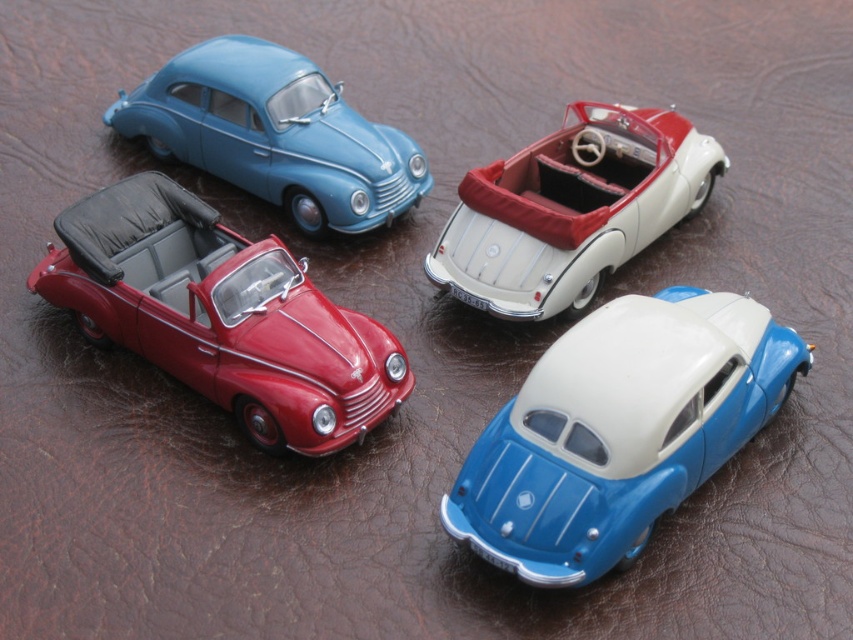
Who is shorter, shiny red convertible at upper left or white matte convertible at upper center?

With less height is white matte convertible at upper center.

Which is behind, point (171, 352) or point (578, 122)?

The point (578, 122) is more distant.

Image resolution: width=853 pixels, height=640 pixels. I want to click on shiny red convertible at upper left, so click(222, 316).

Between point (314, 428) and point (314, 168), which one is positioned behind?

The point (314, 168) is more distant.

Is shiny red convertible at upper left below matte blue car at upper left?

Yes.

This screenshot has width=853, height=640. Describe the element at coordinates (222, 316) in the screenshot. I see `shiny red convertible at upper left` at that location.

Locate an element on the screen. shiny red convertible at upper left is located at coordinates (222, 316).

Is blue glossy toy car at lower right smaller than white matte convertible at upper center?

Incorrect, blue glossy toy car at lower right is not smaller in size than white matte convertible at upper center.

Describe the element at coordinates (619, 429) in the screenshot. The width and height of the screenshot is (853, 640). I see `blue glossy toy car at lower right` at that location.

Locate an element on the screen. This screenshot has width=853, height=640. blue glossy toy car at lower right is located at coordinates (619, 429).

This screenshot has height=640, width=853. What are the coordinates of `blue glossy toy car at lower right` in the screenshot? It's located at coord(619,429).